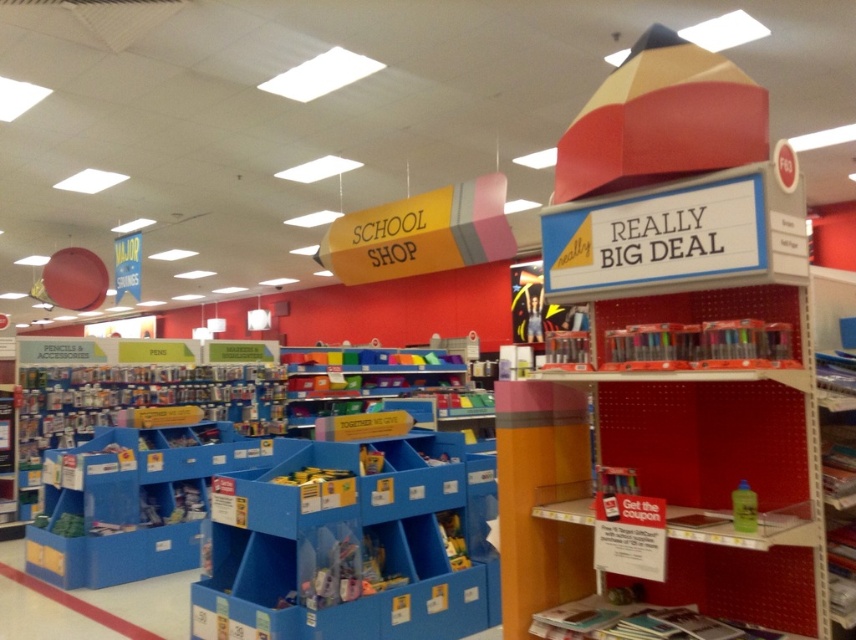
Question: Is blue plastic bins at lower left positioned in front of translucent yellow bottle at center right?

Choices:
 (A) yes
 (B) no

Answer: (B)

Question: Is blue plastic bins at lower left thinner than translucent yellow bottle at center right?

Choices:
 (A) yes
 (B) no

Answer: (B)

Question: Which object appears farthest from the camera in this image?

Choices:
 (A) translucent plastic markers at upper right
 (B) blue plastic bins at lower left

Answer: (B)

Question: Is translucent plastic markers at upper right behind translucent yellow bottle at center right?

Choices:
 (A) no
 (B) yes

Answer: (A)

Question: Which object appears closest to the camera in this image?

Choices:
 (A) translucent plastic markers at upper right
 (B) translucent yellow bottle at center right

Answer: (A)

Question: Which point is farther to the camera?

Choices:
 (A) (750, 500)
 (B) (721, 536)

Answer: (A)